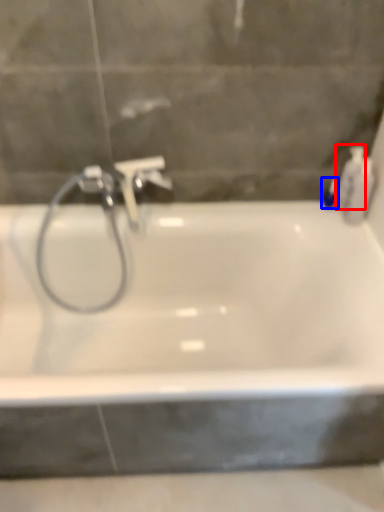
Question: Which object is further to the camera taking this photo, toiletry (highlighted by a red box) or toiletry (highlighted by a blue box)?

Choices:
 (A) toiletry
 (B) toiletry

Answer: (B)